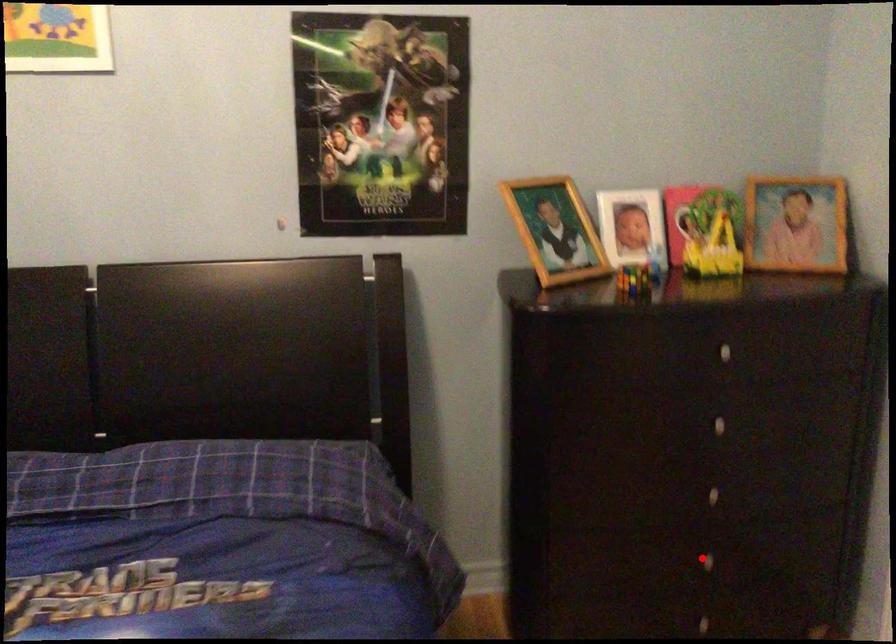
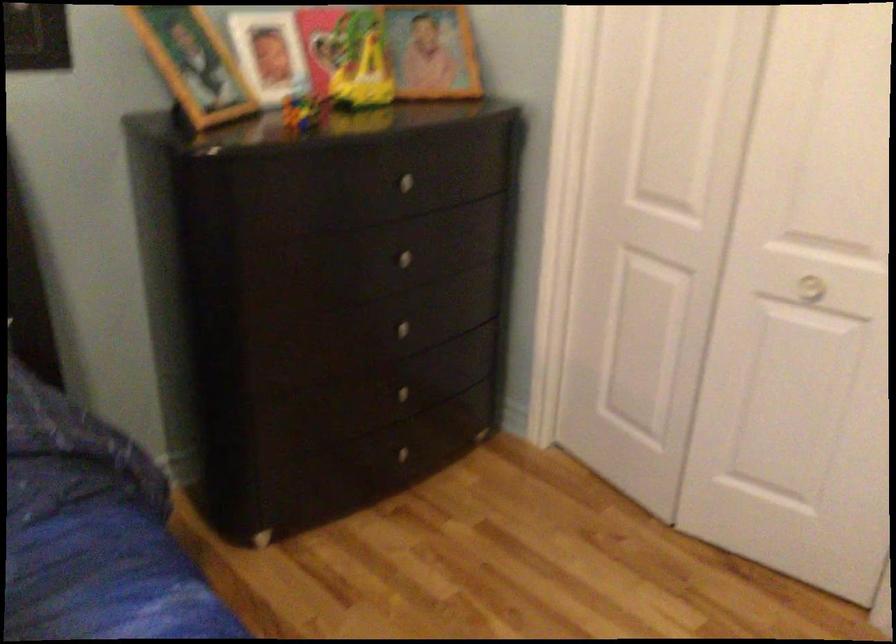
Where in the second image is the point corresponding to the highlighted location from the first image?

(400, 393)